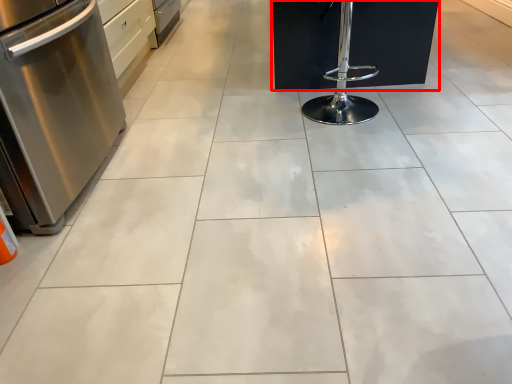
Question: In this image, where is furniture (annotated by the red box) located relative to kitchen appliance?

Choices:
 (A) left
 (B) right

Answer: (B)